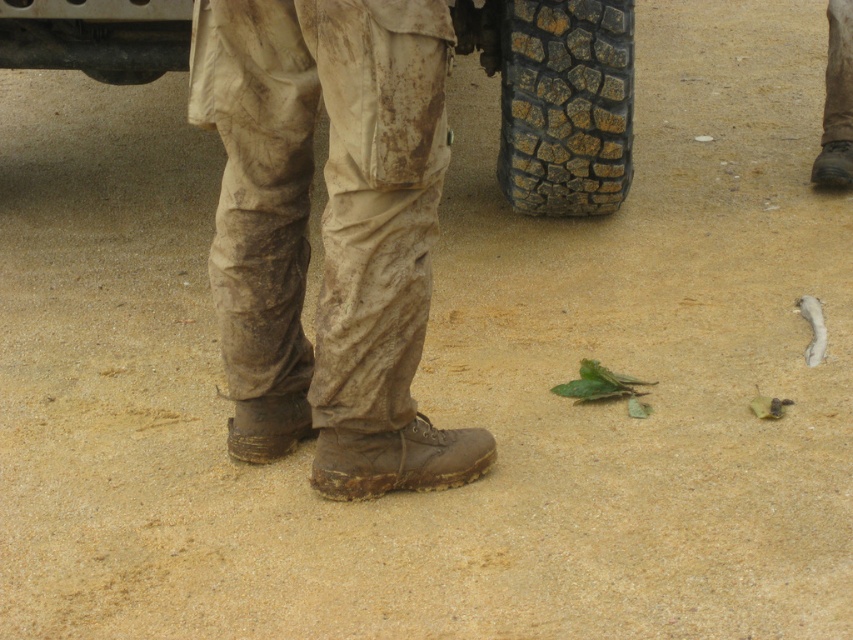
Question: Which point appears closest to the camera in this image?

Choices:
 (A) (155, 1)
 (B) (538, 125)
 (C) (312, 3)
 (D) (288, 429)

Answer: (C)

Question: Which of the following is the closest to the observer?

Choices:
 (A) rubber textured tire at upper center
 (B) black rubber tire at lower center
 (C) muddy canvas pants at center

Answer: (C)

Question: Which point appears closest to the camera in this image?

Choices:
 (A) (265, 422)
 (B) (91, 76)

Answer: (A)

Question: Is black rubber tire at upper center closer to camera compared to brown rugged boot at lower center?

Choices:
 (A) no
 (B) yes

Answer: (A)

Question: Is black rubber tire at upper center smaller than brown rugged boot at lower center?

Choices:
 (A) no
 (B) yes

Answer: (A)

Question: Is muddy canvas pants at center wider than rubber textured tire at upper center?

Choices:
 (A) no
 (B) yes

Answer: (B)